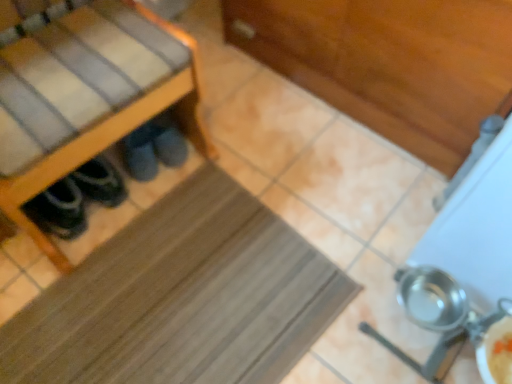
Where is `free spot below brown rubber mat at center (from a real-world perspective)`? free spot below brown rubber mat at center (from a real-world perspective) is located at coordinates (196, 301).